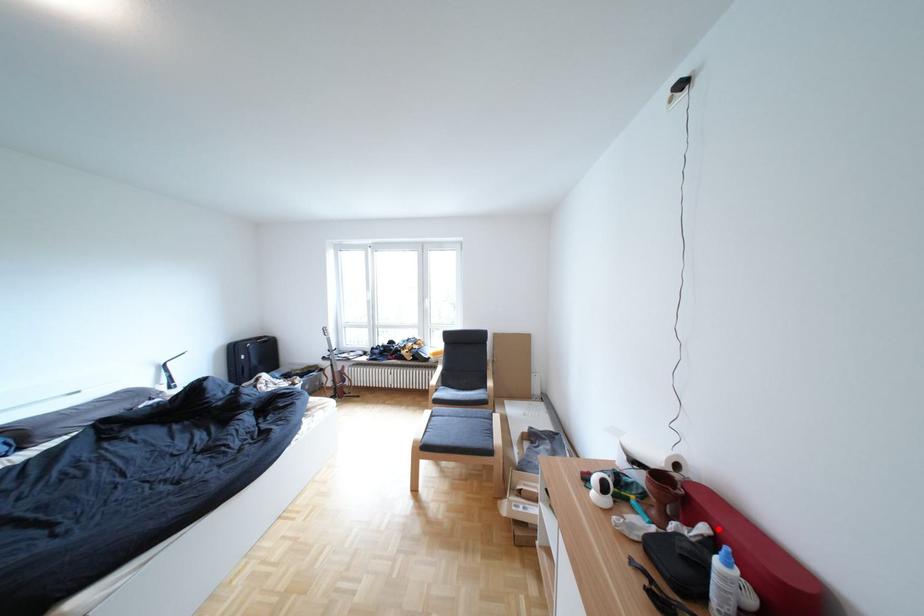
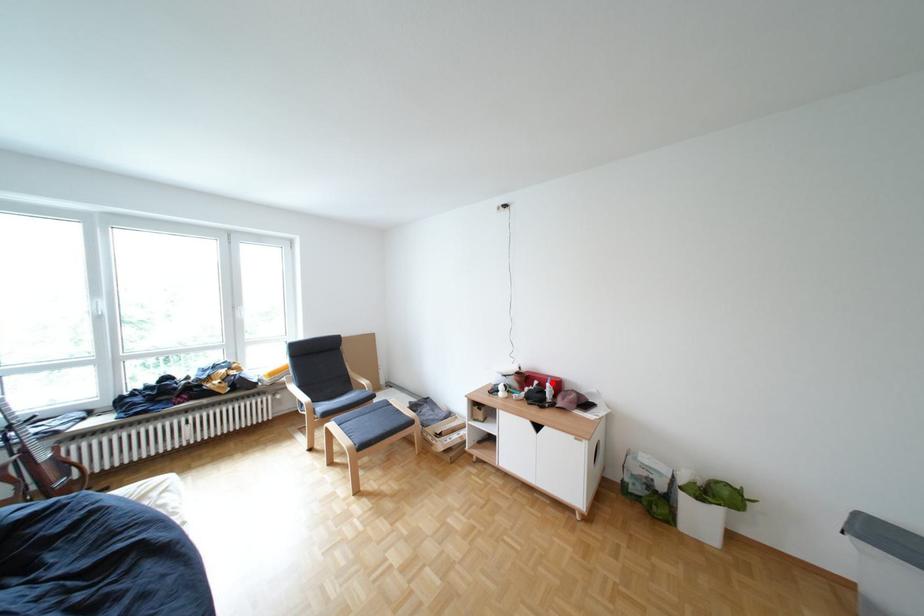
I am providing you with two images of the same scene from different viewpoints. A red point is marked on the first image and another point is marked on the second image. Is the red point in image1 aligned with the point shown in image2?

Yes